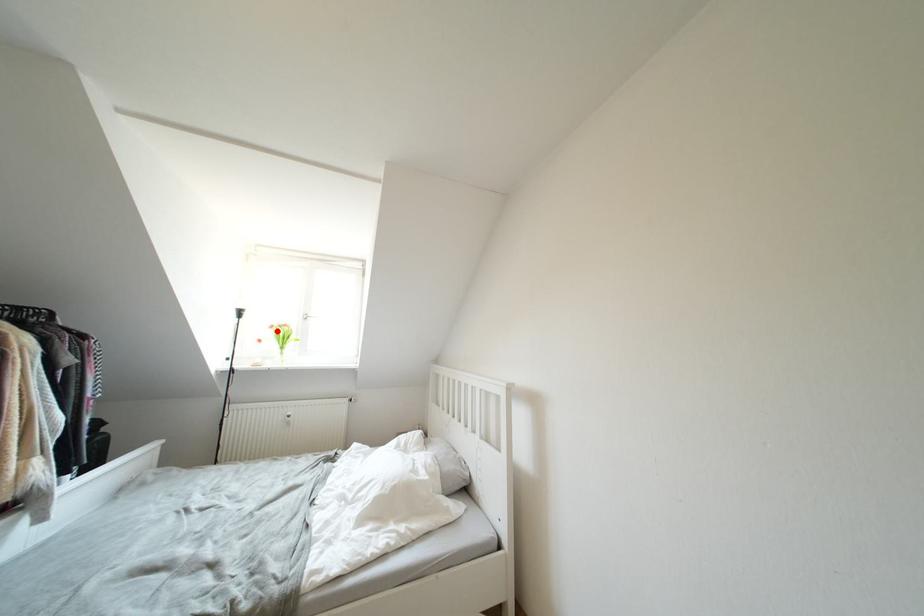
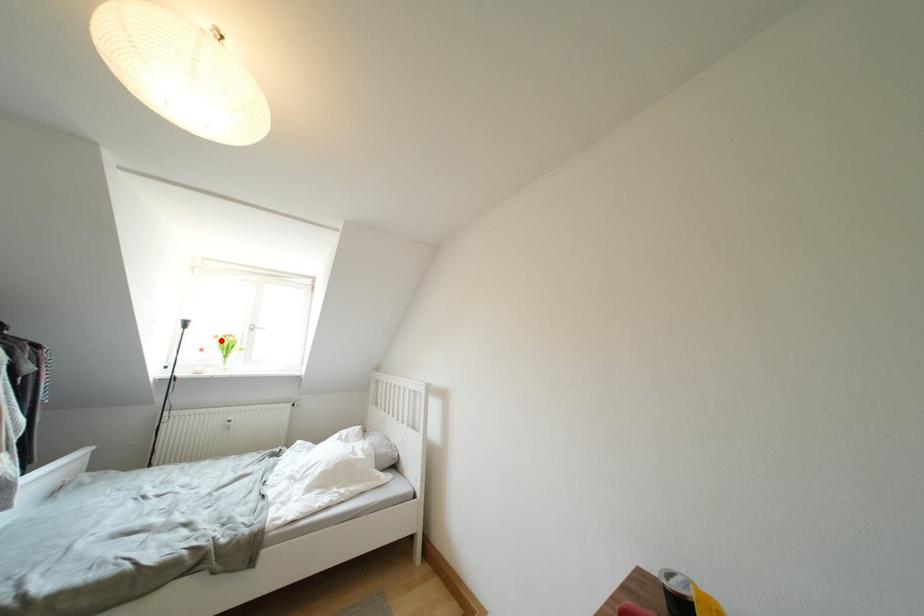
I am providing you with two images of the same scene from different viewpoints. A red point is marked on the first image and another point is marked on the second image. Do the highlighted points in image1 and image2 indicate the same real-world spot?

Yes